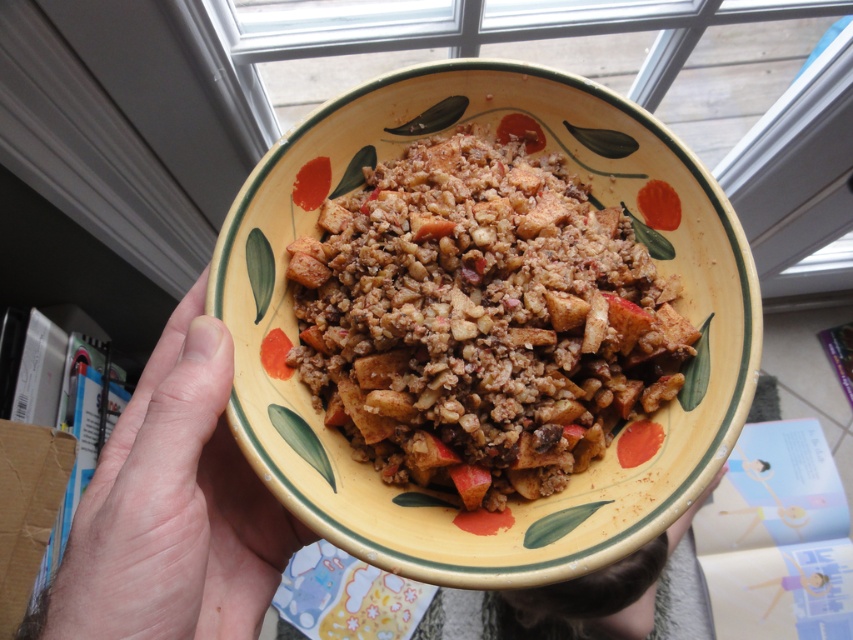
Does pale skin at lower left have a greater height compared to yellow matte bowl at center?

No.

This screenshot has width=853, height=640. What are the coordinates of `pale skin at lower left` in the screenshot? It's located at (173, 506).

Between point (339, 301) and point (210, 577), which one is positioned in front?

Point (210, 577) is more forward.

Is matte brown crumble at center positioned at the back of pale skin at lower left?

Yes.

This screenshot has width=853, height=640. Find the location of `matte brown crumble at center`. matte brown crumble at center is located at coordinates (480, 317).

Is matte brown crumble at center thinner than yellow matte bowl at center?

Yes.

Measure the distance between matte brown crumble at center and camera.

A distance of 20.28 inches exists between matte brown crumble at center and camera.

Is point (329, 332) farther from camera compared to point (235, 515)?

Yes, point (329, 332) is farther from viewer.

At what (x,y) coordinates should I click in order to perform the action: click on matte brown crumble at center. Please return your answer as a coordinate pair (x, y). This screenshot has height=640, width=853. Looking at the image, I should click on (480, 317).